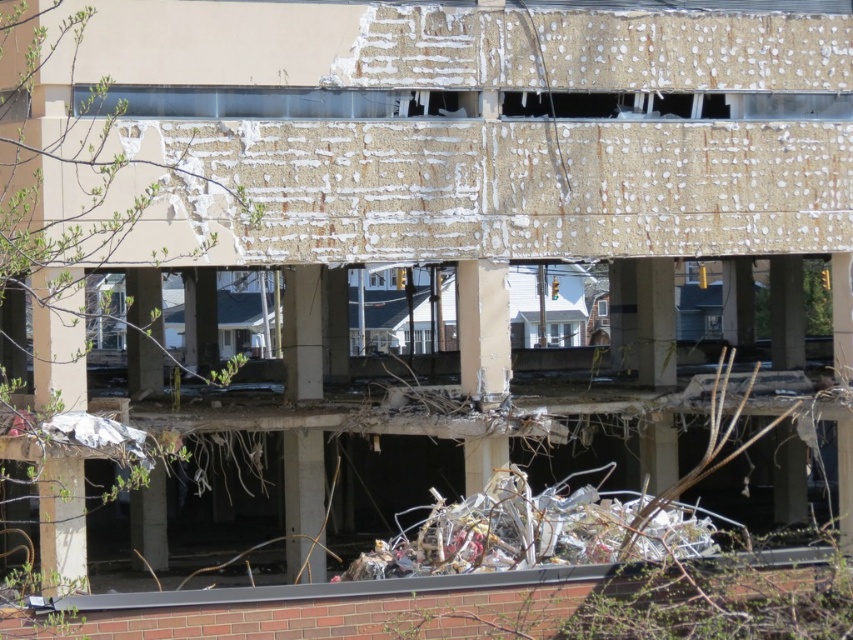
Is concrete at center in front of concrete pillar at center?

No, it is not.

Which is in front, point (294, 532) or point (465, 262)?

Point (465, 262)

Does point (317, 400) come in front of point (469, 344)?

No, it is not.

This screenshot has width=853, height=640. What are the coordinates of `concrete at center` in the screenshot? It's located at 305,504.

Does shiny metallic scrap at center have a larger size compared to concrete pillar at center?

Correct, shiny metallic scrap at center is larger in size than concrete pillar at center.

Where is `shiny metallic scrap at center`? shiny metallic scrap at center is located at coordinates (503, 531).

Locate an element on the screen. The height and width of the screenshot is (640, 853). shiny metallic scrap at center is located at coordinates (503, 531).

Can you confirm if shiny metallic scrap at center is positioned to the right of concrete at center?

Indeed, shiny metallic scrap at center is positioned on the right side of concrete at center.

Is point (685, 552) farther from viewer compared to point (297, 280)?

No, (685, 552) is in front of (297, 280).

Is point (651, 547) closer to viewer compared to point (286, 481)?

That is True.

This screenshot has width=853, height=640. Identify the location of shiny metallic scrap at center. click(503, 531).